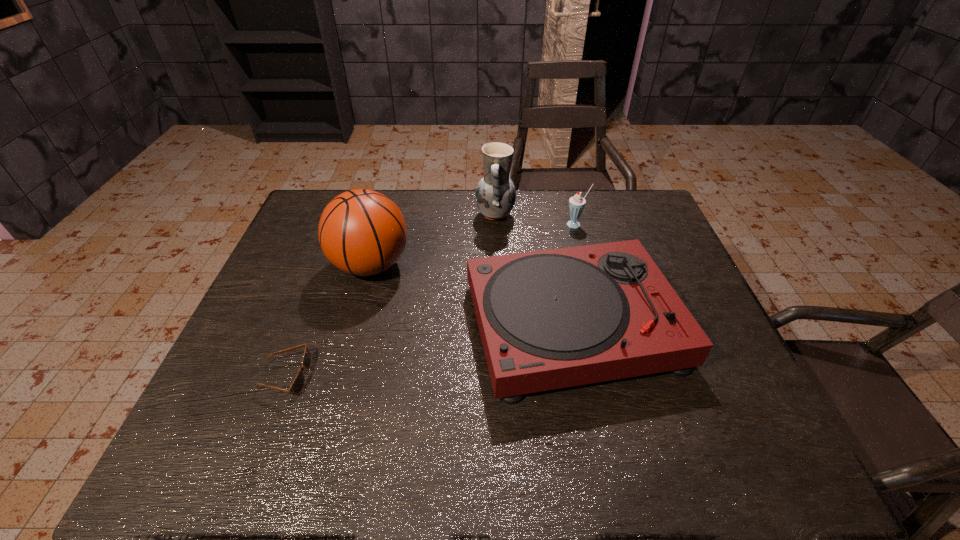
The image size is (960, 540). In order to click on vacant space that's between the pottery and the basketball in this screenshot , I will do `click(433, 240)`.

Select which object appears as the second closest to the record player. Please provide its 2D coordinates. Your answer should be formatted as a tuple, i.e. [(x, y)], where the tuple contains the x and y coordinates of a point satisfying the conditions above.

[(495, 194)]

Identify which object is located as the nearest to the pottery. Please provide its 2D coordinates. Your answer should be formatted as a tuple, i.e. [(x, y)], where the tuple contains the x and y coordinates of a point satisfying the conditions above.

[(577, 203)]

Identify the location of free space that satisfies the following two spatial constraints: 1. on the straw side of the milkshake; 2. on the frames of the shortest object. This screenshot has width=960, height=540. (617, 376).

Locate an element on the screen. vacant region that satisfies the following two spatial constraints: 1. on either side of the record player; 2. on the left side of the pottery is located at coordinates (500, 325).

You are a GUI agent. You are given a task and a screenshot of the screen. Output one action in this format:
    pyautogui.click(x=<x>, y=<y>)
    Task: Click on the free point that satisfies the following two spatial constraints: 1. on the straw side of the milkshake; 2. on the frames of the sunglasses
    This screenshot has height=540, width=960.
    Given the screenshot: What is the action you would take?
    [617, 376]

Locate an element on the screen. Image resolution: width=960 pixels, height=540 pixels. free spot that satisfies the following two spatial constraints: 1. on either side of the pottery; 2. on the front side of the basketball is located at coordinates (497, 266).

Identify the location of vacant region that satisfies the following two spatial constraints: 1. on either side of the pottery; 2. on the back side of the record player. (500, 325).

Image resolution: width=960 pixels, height=540 pixels. What are the coordinates of `vacant space that satisfies the following two spatial constraints: 1. on the straw side of the milkshake; 2. on the frames of the sunglasses` in the screenshot? It's located at (617, 376).

Identify the location of free location that satisfies the following two spatial constraints: 1. on the front side of the record player; 2. on the frames of the sunglasses. (583, 376).